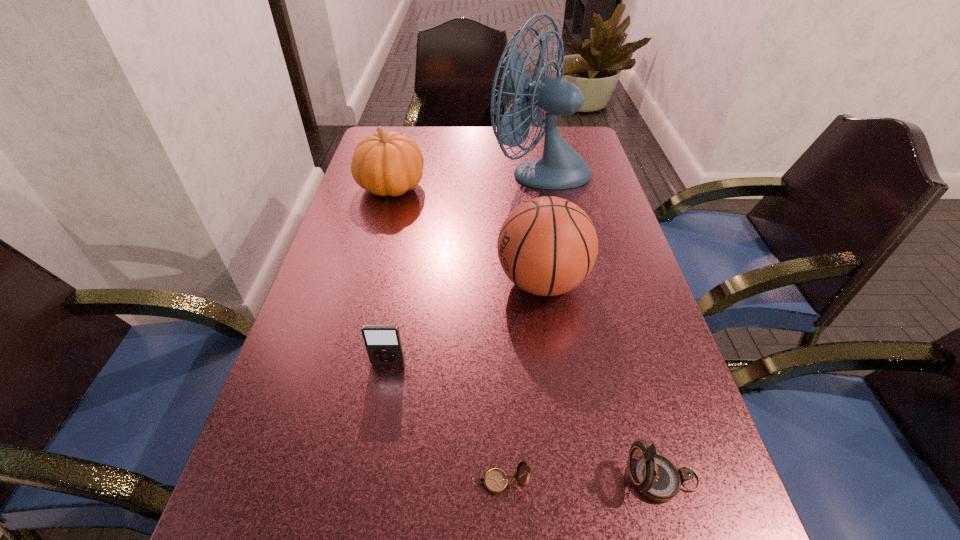
This screenshot has height=540, width=960. I want to click on vacant space located 0.250m on the face of the shorter compass, so click(311, 482).

You are a GUI agent. You are given a task and a screenshot of the screen. Output one action in this format:
    pyautogui.click(x=<x>, y=<y>)
    Task: Click on the object that is positioned at the far edge
    The width and height of the screenshot is (960, 540).
    Given the screenshot: What is the action you would take?
    pyautogui.click(x=561, y=167)

Where is `pumpkin situated at the left edge`? pumpkin situated at the left edge is located at coordinates (390, 163).

Find the location of `iPod situated at the left edge`. iPod situated at the left edge is located at coordinates (383, 343).

The image size is (960, 540). In order to click on fan present at the right edge in this screenshot , I will do `click(561, 167)`.

Identify the location of basketball that is at the right edge. (547, 246).

At what (x,y) coordinates should I click in order to perform the action: click on compass located at the right edge. Please return your answer as a coordinate pair (x, y). The image size is (960, 540). Looking at the image, I should click on (656, 477).

You are a GUI agent. You are given a task and a screenshot of the screen. Output one action in this format:
    pyautogui.click(x=<x>, y=<y>)
    Task: Click on the object that is positioned at the far right corner
    This screenshot has width=960, height=540.
    Given the screenshot: What is the action you would take?
    pyautogui.click(x=561, y=167)

Identify the location of free space at the far edge of the desktop. (473, 135).

You are a GUI agent. You are given a task and a screenshot of the screen. Output one action in this format:
    pyautogui.click(x=<x>, y=<y>)
    Task: Click on the vacant space at the left edge of the desktop
    The image size is (960, 540).
    Given the screenshot: What is the action you would take?
    pyautogui.click(x=359, y=338)